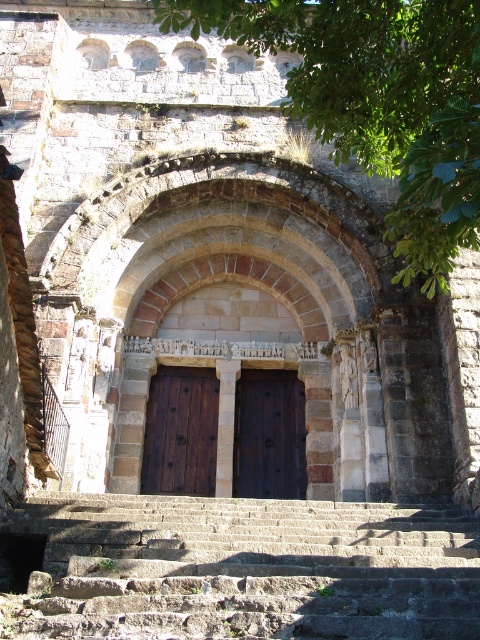
Who is positioned more to the right, rustic stone stairs at lower center or green leafy tree at upper center?

From the viewer's perspective, green leafy tree at upper center appears more on the right side.

Does rustic stone stairs at lower center lie behind green leafy tree at upper center?

Yes, it is behind green leafy tree at upper center.

Is point (446, 627) in front of point (400, 77)?

Yes, point (446, 627) is in front of point (400, 77).

In order to click on rustic stone stairs at lower center in this screenshot , I will do pyautogui.click(x=245, y=570).

What do you see at coordinates (180, 432) in the screenshot? This screenshot has height=640, width=480. I see `brown wooden door at center` at bounding box center [180, 432].

Between brown wooden door at center and dark wood door at center, which one appears on the left side from the viewer's perspective?

Answer: Positioned to the left is brown wooden door at center.

Is point (160, 420) positioned in front of point (288, 497)?

No, it is not.

At what (x,y) coordinates should I click in order to perform the action: click on brown wooden door at center. Please return your answer as a coordinate pair (x, y). The width and height of the screenshot is (480, 640). Looking at the image, I should click on (180, 432).

Is rustic stone stairs at lower center positioned behind dark wood door at center?

No, rustic stone stairs at lower center is in front of dark wood door at center.

Is point (462, 566) positioned in front of point (282, 374)?

Yes, point (462, 566) is closer to viewer.

Which is in front, point (245, 580) or point (252, 403)?

Point (245, 580)

This screenshot has height=640, width=480. Identify the location of rustic stone stairs at lower center. (245, 570).